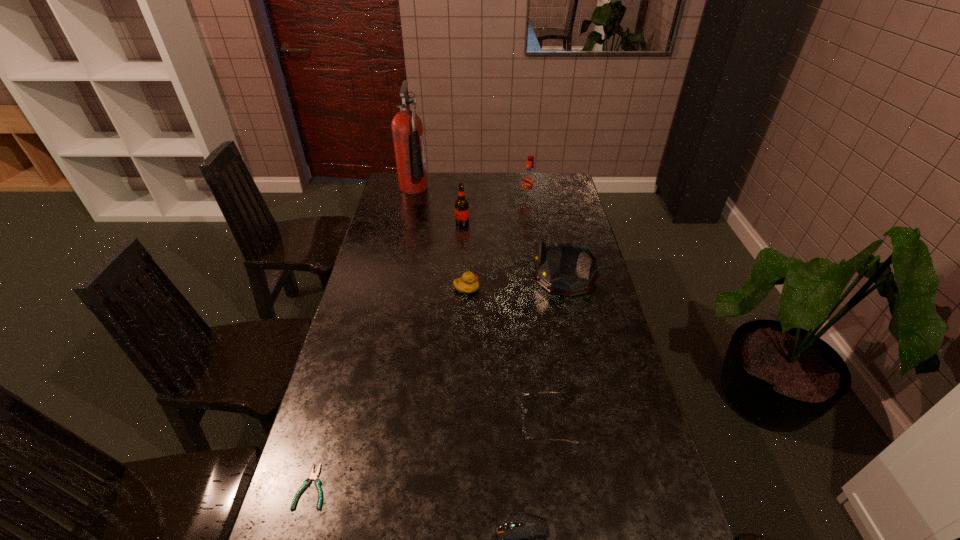
At what (x,y) coordinates should I click in order to perform the action: click on vacant space located on the left of the farther root beer. Please return your answer as a coordinate pair (x, y). Image resolution: width=960 pixels, height=540 pixels. Looking at the image, I should click on (471, 200).

Identify the location of vacant space located on the front of the left root beer. This screenshot has width=960, height=540. (462, 233).

The height and width of the screenshot is (540, 960). I want to click on vacant space located at the front of the tiara with jewels, so click(x=482, y=277).

Image resolution: width=960 pixels, height=540 pixels. Identify the location of vacant space located 0.150m at the front of the tiara with jewels. (492, 277).

The image size is (960, 540). Identify the location of vacant area situated at the front of the tiara with jewels. (441, 277).

Locate an element on the screen. vacant space situated at the beak of the duckling is located at coordinates (496, 289).

The width and height of the screenshot is (960, 540). Find the location of `vacant space located 0.210m on the front-facing side of the spectacles`. vacant space located 0.210m on the front-facing side of the spectacles is located at coordinates (442, 423).

Where is `vacant space located on the front-facing side of the spectacles`? vacant space located on the front-facing side of the spectacles is located at coordinates (479, 423).

In order to click on vacant space located 0.350m on the front-facing side of the spectacles in this screenshot , I will do `click(390, 423)`.

You are a GUI agent. You are given a task and a screenshot of the screen. Output one action in this format:
    pyautogui.click(x=<x>, y=<y>)
    Task: Click on the free point located 0.270m on the right of the seventh farthest object
    
    Given the screenshot: What is the action you would take?
    pyautogui.click(x=440, y=487)